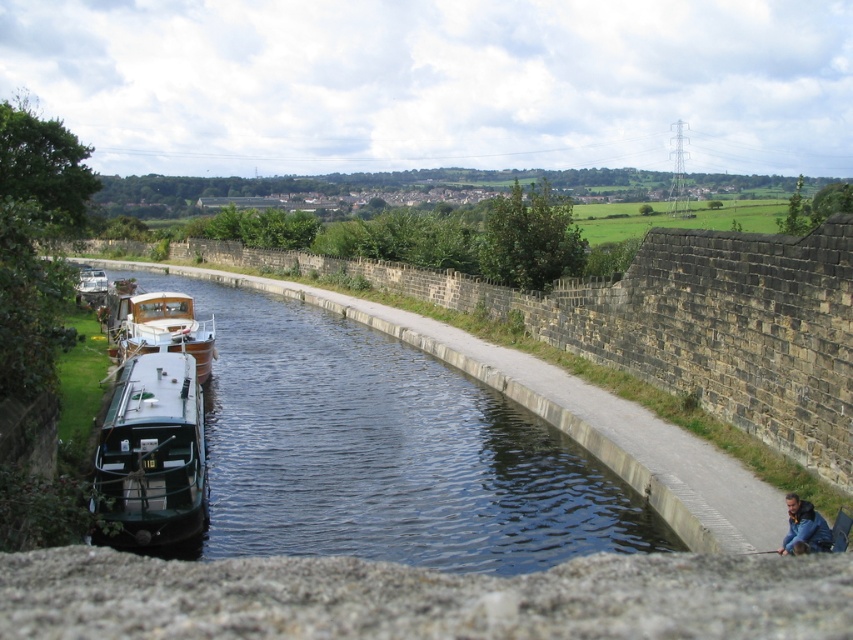
Between point (392, 388) and point (108, 308), which one is positioned in front?

Positioned in front is point (392, 388).

Is point (619, 492) farther from viewer compared to point (207, 340)?

No, (619, 492) is in front of (207, 340).

Who is more distant from viewer, (474, 417) or (171, 324)?

Point (171, 324)

Where is `green rubber boat at left`? The width and height of the screenshot is (853, 640). green rubber boat at left is located at coordinates (387, 451).

Can you confirm if green rubber boat at left is positioned above green matte boat at left?

No.

In the scene shown: Measure the distance between green rubber boat at left and camera.

A distance of 11.96 meters exists between green rubber boat at left and camera.

Who is more distant from viewer, (596, 534) or (96, 285)?

Positioned behind is point (96, 285).

I want to click on green rubber boat at left, so click(387, 451).

Does green polished wood boat at left appear on the right side of wooden polished boat at center?

Yes, green polished wood boat at left is to the right of wooden polished boat at center.

Does point (131, 378) lie behind point (165, 307)?

No, (131, 378) is closer to viewer.

You are a GUI agent. You are given a task and a screenshot of the screen. Output one action in this format:
    pyautogui.click(x=<x>, y=<y>)
    Task: Click on the green polished wood boat at left
    This screenshot has width=853, height=640.
    Given the screenshot: What is the action you would take?
    pyautogui.click(x=152, y=452)